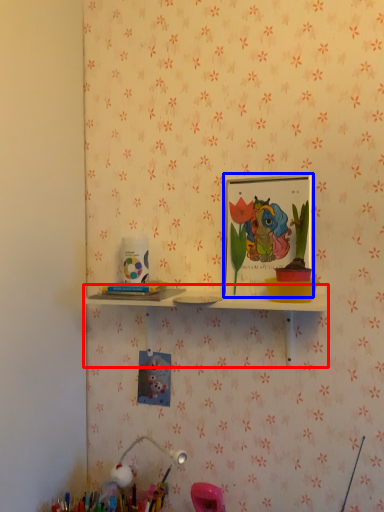
Question: Which of the following is the farthest to the observer, shelf (highlighted by a red box) or picture frame (highlighted by a blue box)?

Choices:
 (A) shelf
 (B) picture frame

Answer: (B)